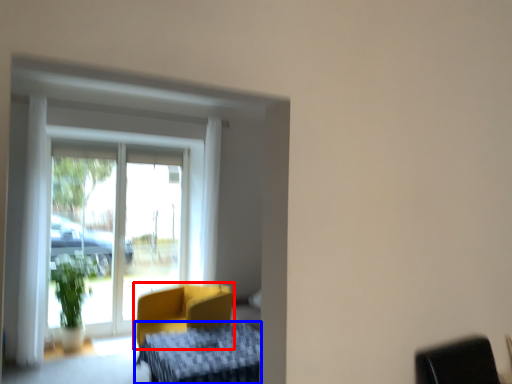
Question: Which object is further to the camera taking this photo, chair (highlighted by a red box) or furniture (highlighted by a blue box)?

Choices:
 (A) chair
 (B) furniture

Answer: (A)